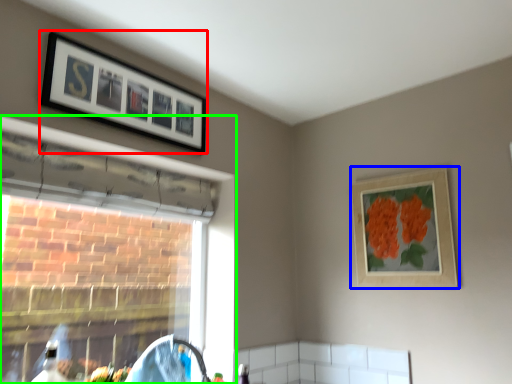
Question: Which object is the closest to the picture frame (highlighted by a red box)? Choose among these: picture frame (highlighted by a blue box) or window (highlighted by a green box).

Choices:
 (A) picture frame
 (B) window

Answer: (B)